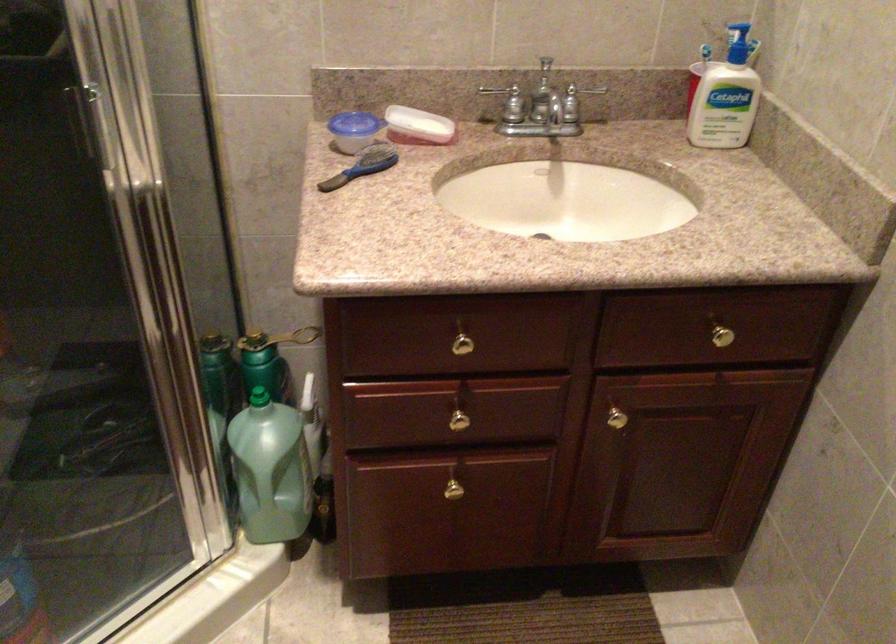
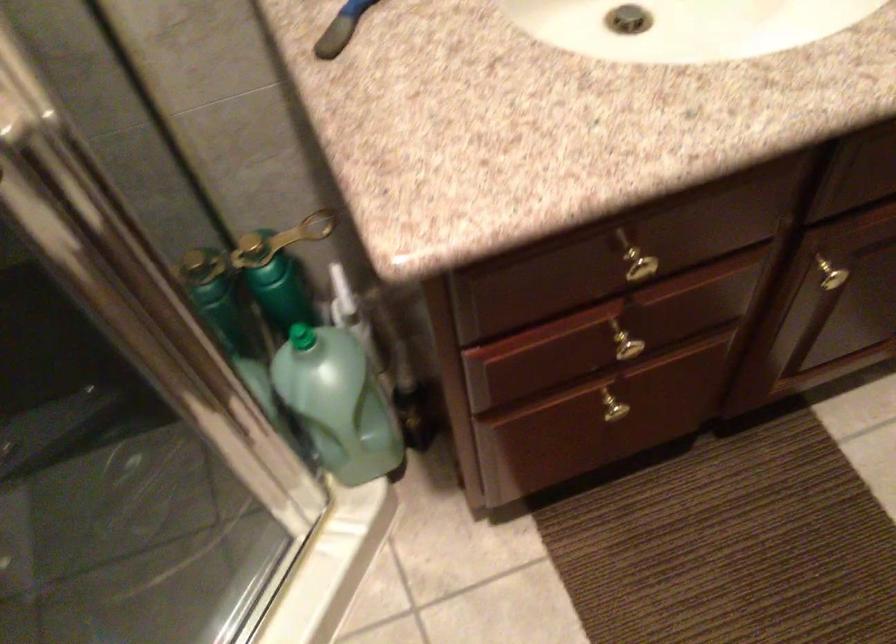
In the second image, find the point that corresponds to (457,418) in the first image.

(625, 346)